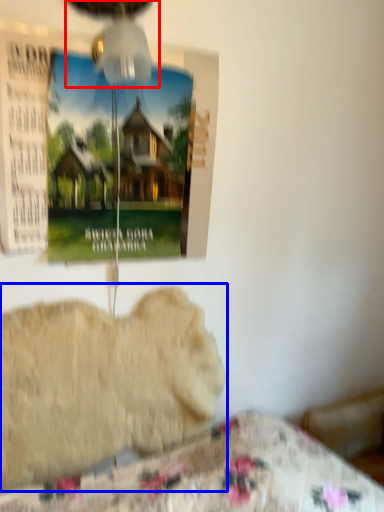
Question: Which of the following is the closest to the observer, mechanical fan (highlighted by a red box) or animal (highlighted by a blue box)?

Choices:
 (A) mechanical fan
 (B) animal

Answer: (A)